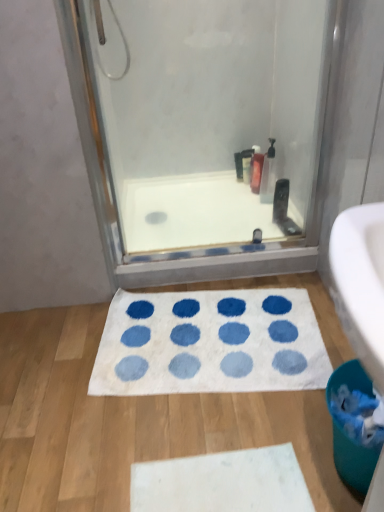
Question: From the image's perspective, is white soft bath mat at center positioned above or below transparent glass shower door at upper center?

Choices:
 (A) above
 (B) below

Answer: (B)

Question: From a real-world perspective, is white soft bath mat at center positioned above or below transparent glass shower door at upper center?

Choices:
 (A) above
 (B) below

Answer: (B)

Question: Which object is positioned closest to the clear plastic pump bottle at upper right, acting as the first cleaning product starting from the front?

Choices:
 (A) white soft bath mat at center
 (B) matte black bottle at upper center
 (C) translucent plastic bottle at upper center, which ranks as the second cleaning product in front-to-back order
 (D) teal plastic toilet bowl at lower right
 (E) white smooth bathtub at center

Answer: (C)

Question: Which of these objects is positioned farthest from the translucent plastic bottle at upper center, the first cleaning product viewed from the back?

Choices:
 (A) clear plastic pump bottle at upper right, acting as the first cleaning product starting from the front
 (B) teal plastic toilet bowl at lower right
 (C) white soft bath mat at center
 (D) matte black bottle at upper center
 (E) transparent glass shower door at upper center

Answer: (B)